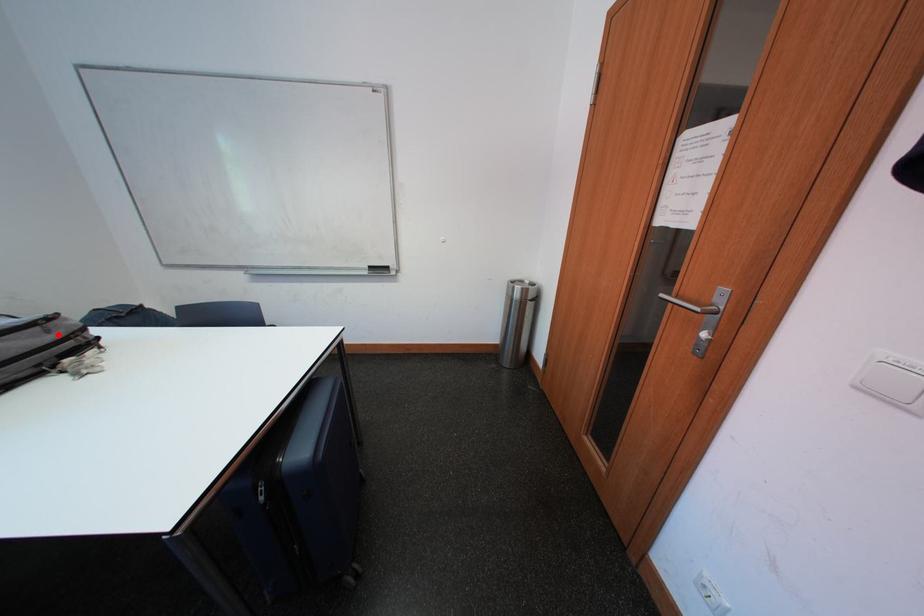
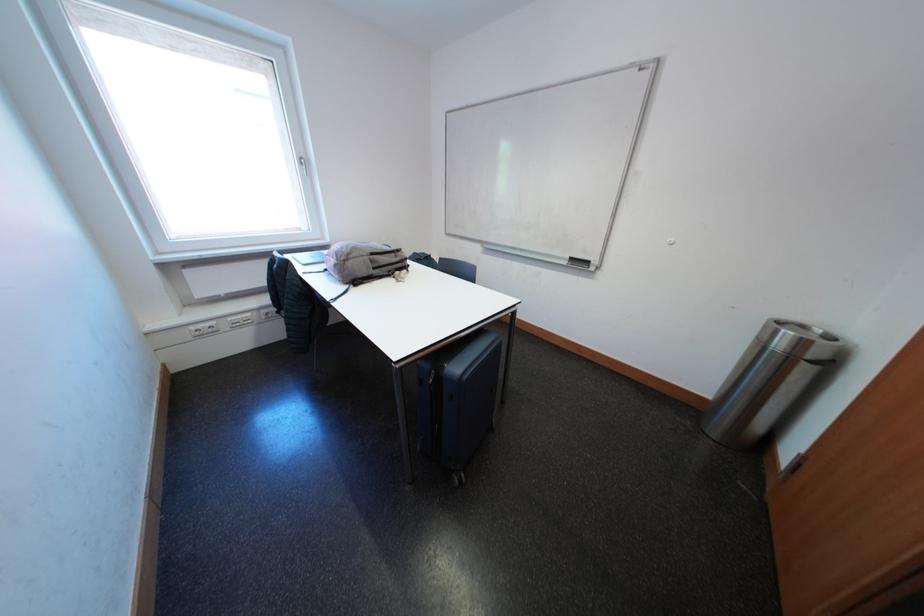
Question: A red point is marked in image1. In image2, is the corresponding 3D point closer to the camera or farther? Reply with the corresponding letter.

Choices:
 (A) The corresponding 3D point is closer.
 (B) The corresponding 3D point is farther.

Answer: (A)